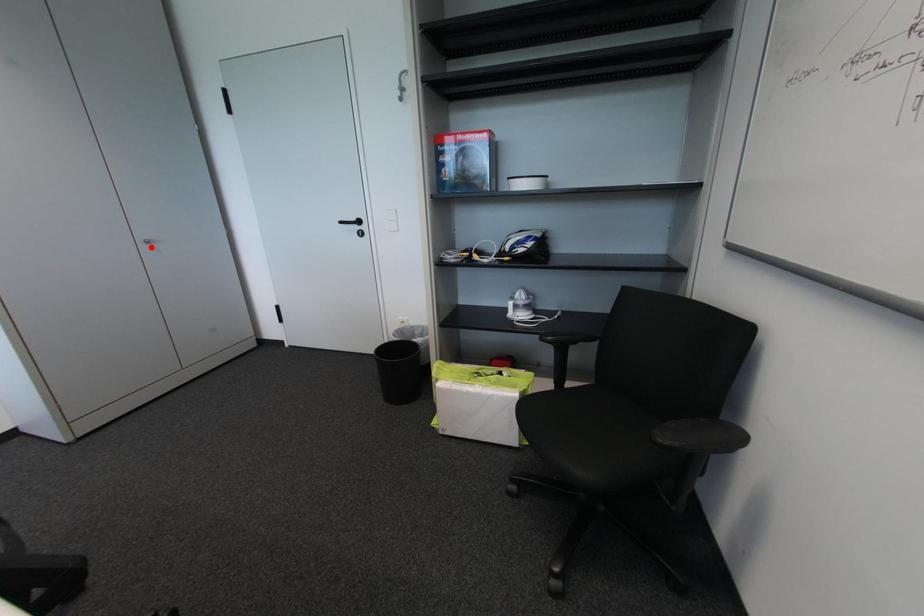
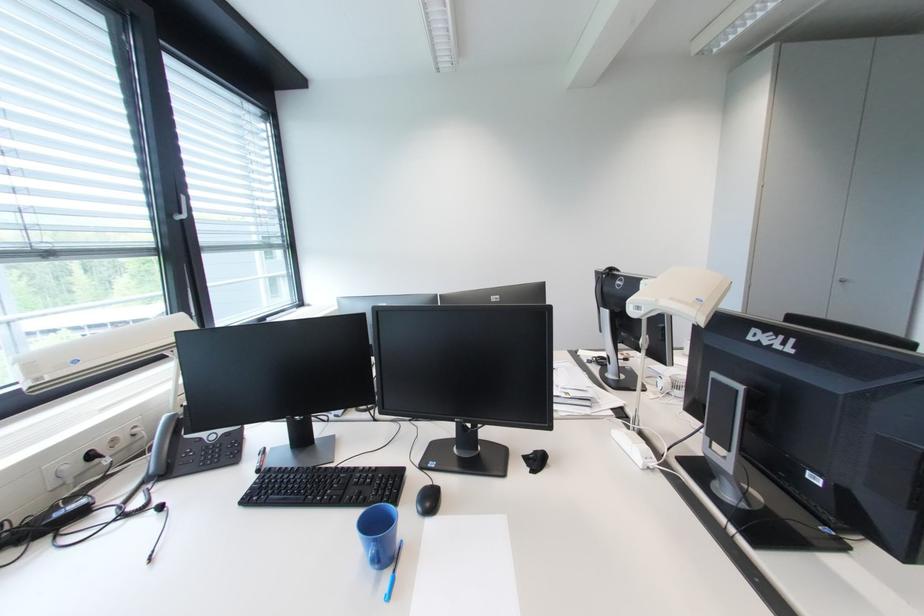
Where in the second image is the point corresponding to the highlighted location from the first image?

(844, 285)